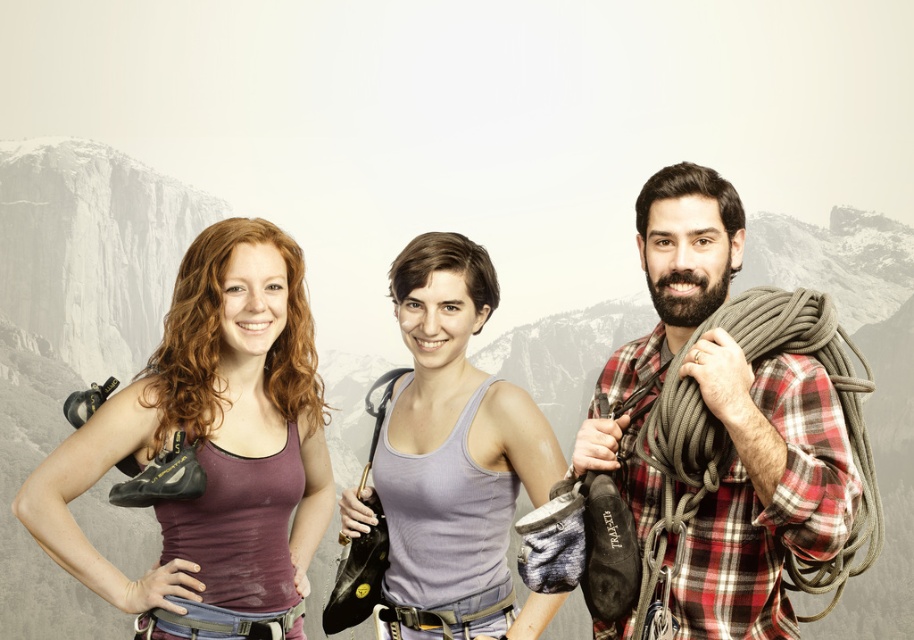
Can you confirm if matte purple tank top at center is taller than purple matte tank top at center?

Indeed, matte purple tank top at center has a greater height compared to purple matte tank top at center.

Who is positioned more to the left, matte purple tank top at center or purple matte tank top at center?

Positioned to the left is matte purple tank top at center.

Is point (301, 273) more distant than point (543, 416)?

That is False.

The width and height of the screenshot is (914, 640). Find the location of `matte purple tank top at center`. matte purple tank top at center is located at coordinates (211, 448).

Which is more to the left, matte purple tank top at center or plaid flannel shirt at center?

matte purple tank top at center

Which is above, matte purple tank top at center or plaid flannel shirt at center?

Positioned higher is plaid flannel shirt at center.

Is point (167, 340) farther from viewer compared to point (849, 518)?

Yes, point (167, 340) is farther from viewer.

This screenshot has height=640, width=914. I want to click on matte purple tank top at center, so click(x=211, y=448).

Is plaid flannel shirt at center taller than purple matte tank top at center?

Yes, plaid flannel shirt at center is taller than purple matte tank top at center.

Is point (720, 497) more distant than point (449, 595)?

No, (720, 497) is in front of (449, 595).

At what (x,y) coordinates should I click in order to perform the action: click on plaid flannel shirt at center. Please return your answer as a coordinate pair (x, y). Looking at the image, I should click on (762, 490).